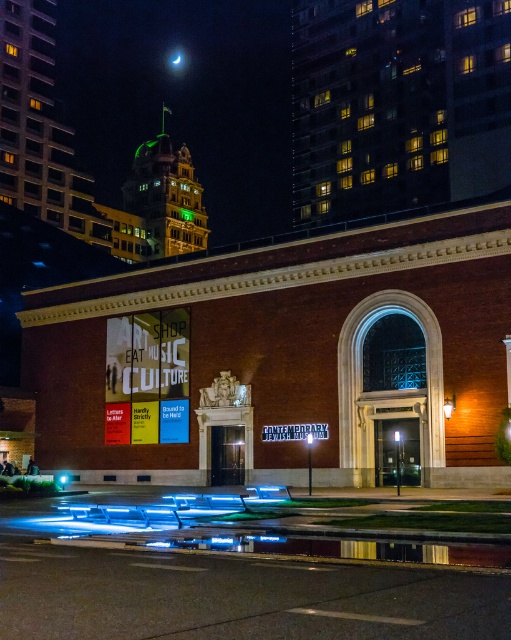
Can you confirm if matte glass sign at center is positioned to the left of brick building at upper right?

Yes, matte glass sign at center is to the left of brick building at upper right.

Is point (111, 435) positioned in front of point (398, 70)?

That is True.

Does point (112, 424) come behind point (335, 29)?

No, it is in front of (335, 29).

Locate an element on the screen. This screenshot has width=511, height=640. matte glass sign at center is located at coordinates (286, 356).